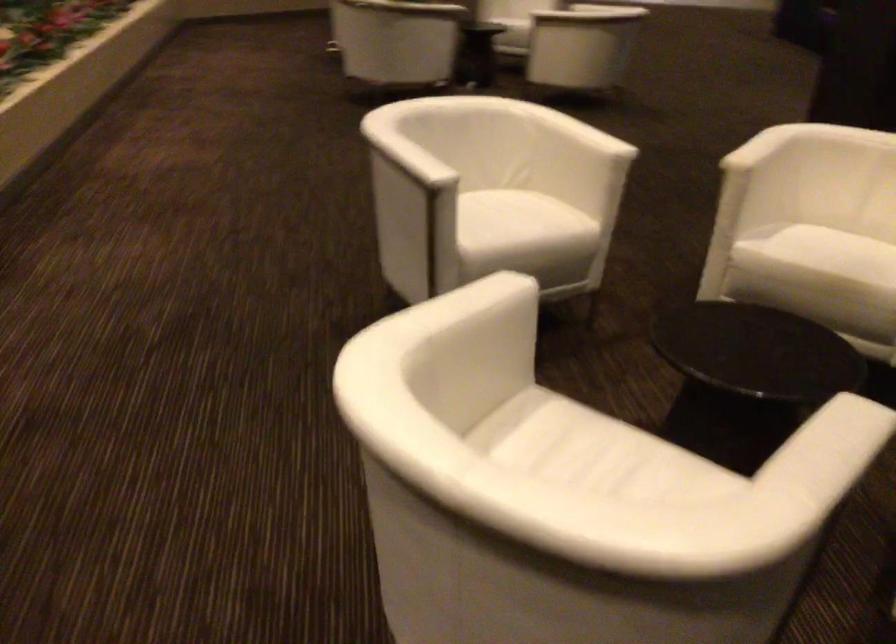
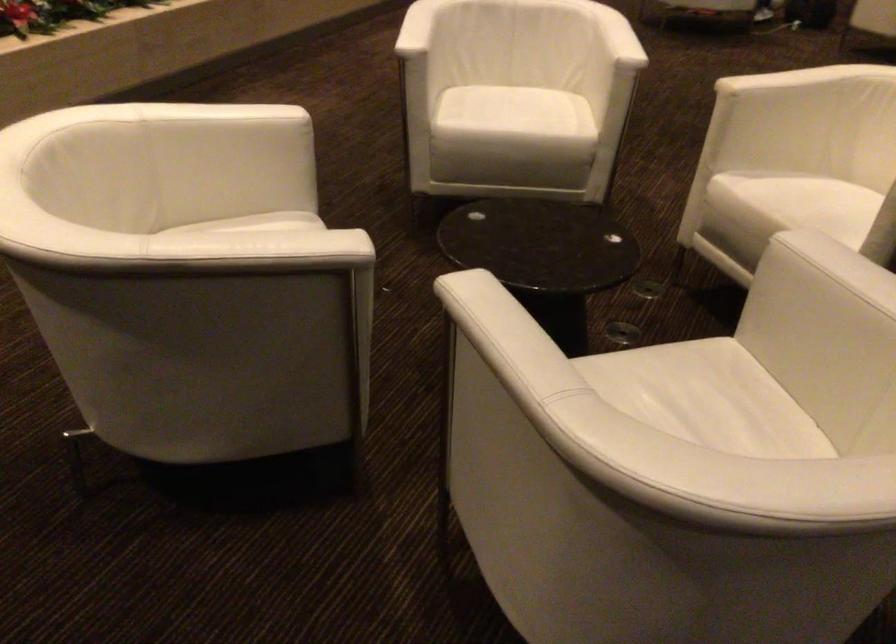
Where in the second image is the point corresponding to point 536,225 from the first image?

(524, 117)